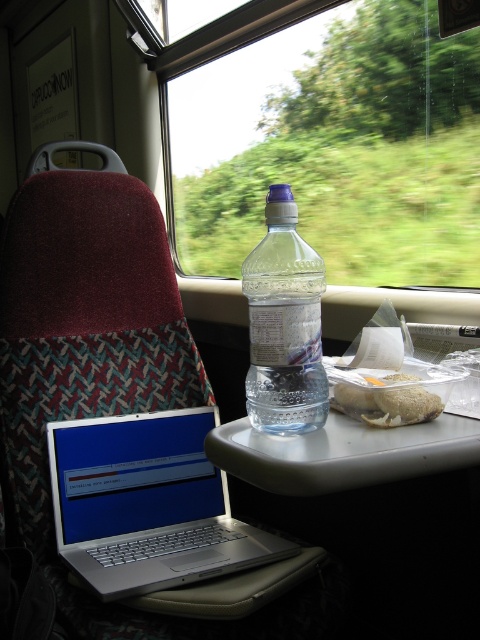
Question: Which point is farther to the camera?

Choices:
 (A) clear plastic bottle at center
 (B) white matte sandwich at center

Answer: (B)

Question: From the image, what is the correct spatial relationship of transparent plastic bottle at upper center in relation to clear plastic bottle at center?

Choices:
 (A) above
 (B) below

Answer: (A)

Question: Considering the real-world distances, which object is farthest from the clear plastic bottle at center?

Choices:
 (A) clear plastic tray at center
 (B) silver metallic laptop at lower left
 (C) transparent plastic bottle at upper center
 (D) white matte sandwich at center

Answer: (C)

Question: Which object is closer to the camera taking this photo?

Choices:
 (A) transparent plastic bottle at upper center
 (B) clear plastic tray at center

Answer: (B)

Question: Does clear plastic bottle at center appear on the right side of clear plastic tray at center?

Choices:
 (A) yes
 (B) no

Answer: (B)

Question: Does clear plastic tray at center appear over white matte sandwich at center?

Choices:
 (A) no
 (B) yes

Answer: (A)